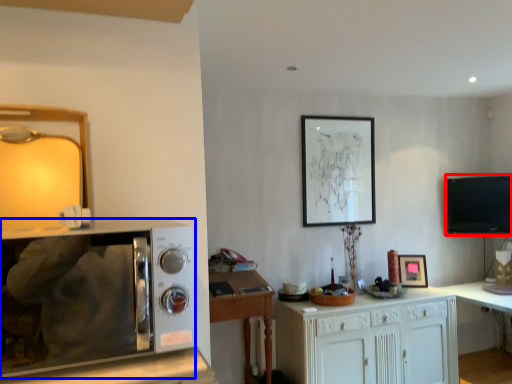
Question: Which object is closer to the camera taking this photo, television (highlighted by a red box) or microwave oven (highlighted by a blue box)?

Choices:
 (A) television
 (B) microwave oven

Answer: (B)